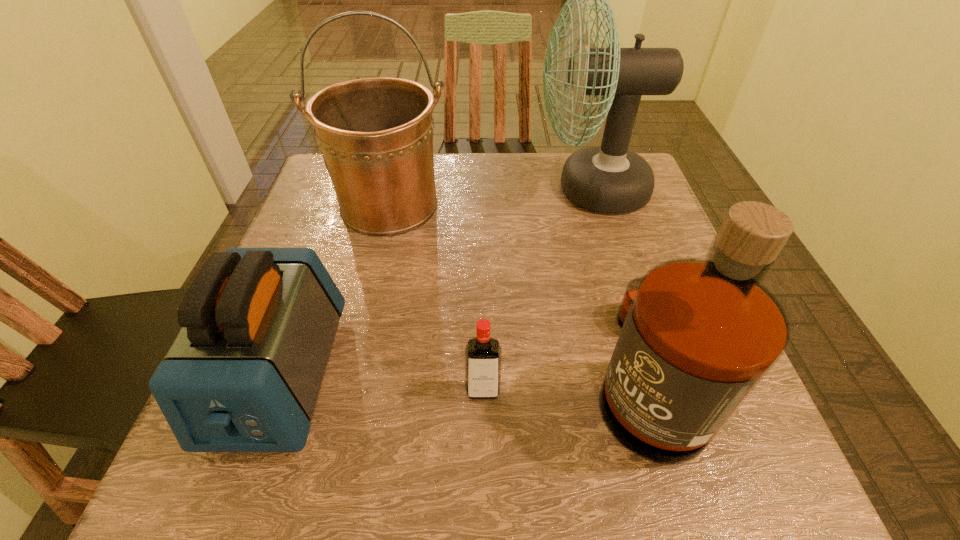
Identify the location of fan. The width and height of the screenshot is (960, 540). (609, 178).

This screenshot has height=540, width=960. Identify the location of bucket. (375, 134).

Find the location of a particular element. The width and height of the screenshot is (960, 540). liquor is located at coordinates (698, 335).

Locate an element on the screen. This screenshot has width=960, height=540. toaster is located at coordinates (244, 373).

Locate an element on the screen. The height and width of the screenshot is (540, 960). vodka is located at coordinates (483, 354).

The height and width of the screenshot is (540, 960). I want to click on the shortest object, so click(483, 354).

The height and width of the screenshot is (540, 960). Find the location of `vacant region located 0.200m in front of the fan where the airflow is directed`. vacant region located 0.200m in front of the fan where the airflow is directed is located at coordinates (452, 189).

Where is `free space located 0.260m in front of the fan where the airflow is directed`? The image size is (960, 540). free space located 0.260m in front of the fan where the airflow is directed is located at coordinates (427, 189).

Find the location of a particular element. vacant area situated 0.300m in front of the fan where the airflow is directed is located at coordinates click(x=411, y=189).

This screenshot has height=540, width=960. What are the coordinates of `free space located 0.260m on the front of the bucket` in the screenshot? It's located at (357, 342).